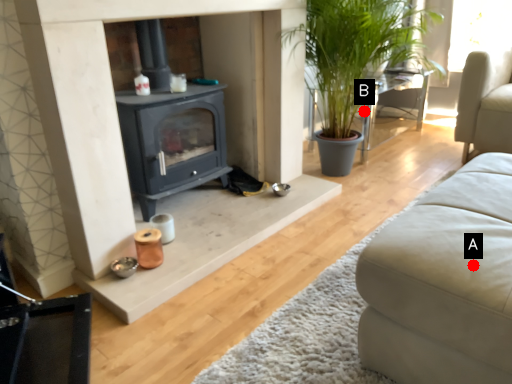
Question: Two points are circled on the image, labeled by A and B beside each circle. Which point is farther to the camera?

Choices:
 (A) A is further
 (B) B is further

Answer: (B)